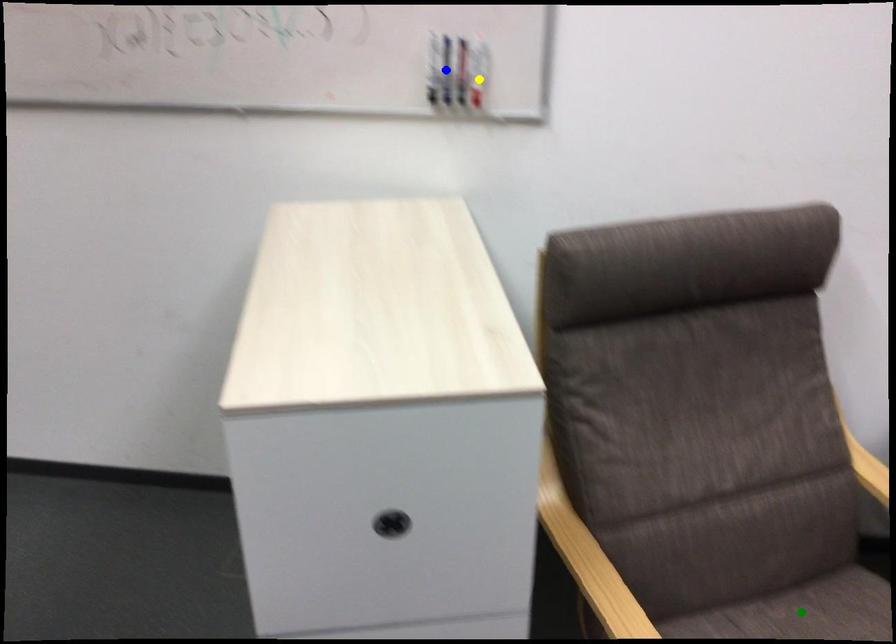
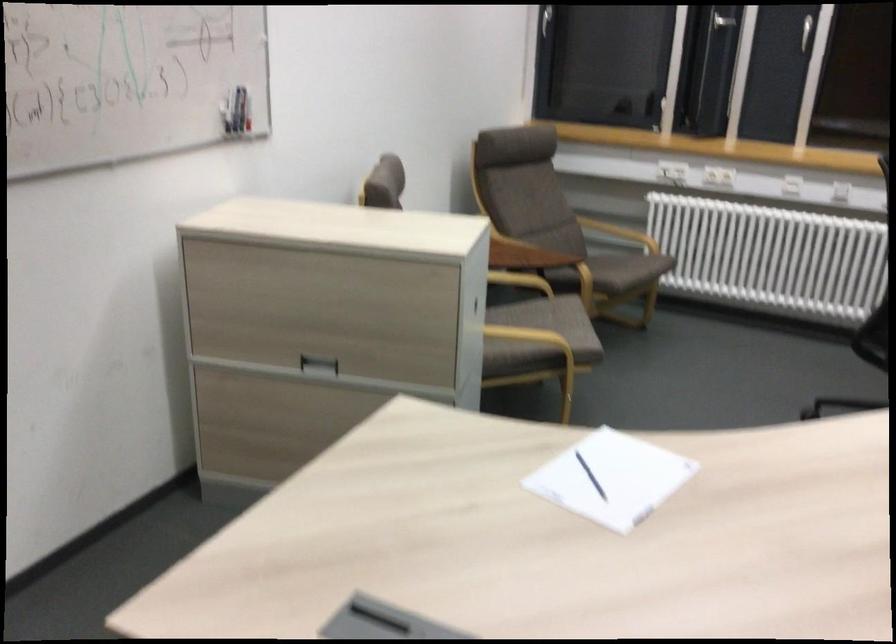
I am providing you with two images of the same scene from different viewpoints. Three points are marked in image1. Which point corresponds to a part or object that is occluded in image2?In image1, three points are marked. Which of them correspond to a part or object that is occluded in image2?Among the three points shown in image1, which one corresponds to a part or object that is no longer visible due to occlusion in image2?

green point